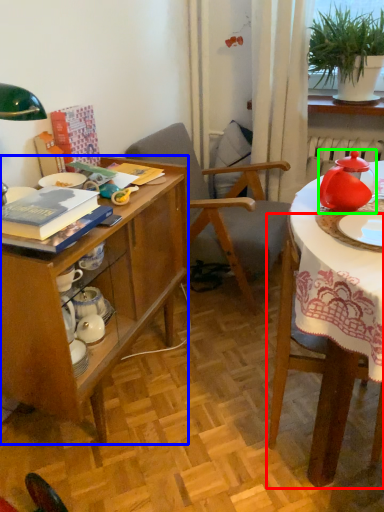
Question: Which object is positioned farthest from chair (highlighted by a red box)? Select from desk (highlighted by a blue box) and tableware (highlighted by a green box).

Choices:
 (A) desk
 (B) tableware

Answer: (A)